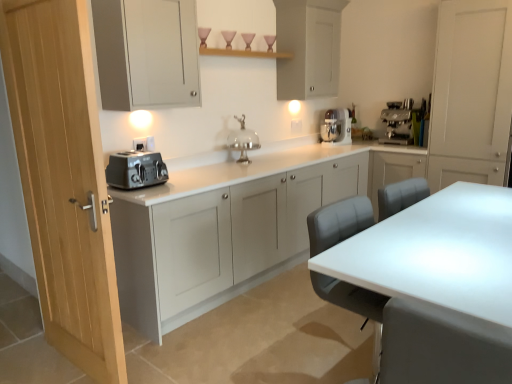
Question: Considering the positions of satin silver toaster at left and silver metallic cake stand at center in the image, is satin silver toaster at left taller or shorter than silver metallic cake stand at center?

Choices:
 (A) short
 (B) tall

Answer: (A)

Question: From the image's perspective, is satin silver toaster at left located above or below silver metallic cake stand at center?

Choices:
 (A) above
 (B) below

Answer: (B)

Question: Based on their relative distances, which object is farther from the silver metallic cake stand at center?

Choices:
 (A) matte gray cabinet at upper left, the fourth cabinetry in the right-to-left sequence
 (B) light wood door at left
 (C) white glossy table at lower right
 (D) matte white electric outlet at upper center
 (E) white glossy stand mixer at upper right

Answer: (C)

Question: Based on their relative distances, which object is farther from the satin silver toaster at left?

Choices:
 (A) matte gray cabinet at upper left, marked as the first cabinetry in a left-to-right arrangement
 (B) white glossy stand mixer at upper right
 (C) light wood door at left
 (D) matte white cabinet at upper center, which ranks as the second cabinetry in right-to-left order
 (E) white glossy table at lower right

Answer: (B)